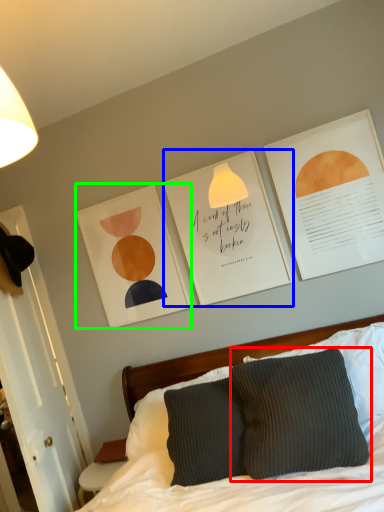
Question: Estimate the real-world distances between objects in this image. Which object is closer to pillow (highlighted by a red box), postcard (highlighted by a blue box) or picture frame (highlighted by a green box)?

Choices:
 (A) postcard
 (B) picture frame

Answer: (A)